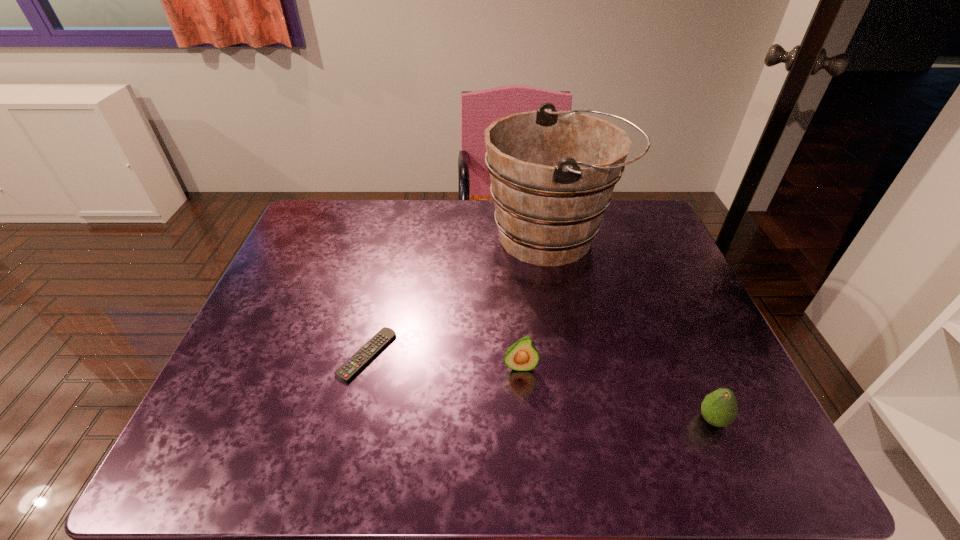
Where is `free region that satisfies the following two spatial constraints: 1. on the handle side of the right avocado; 2. on the left side of the bucket`? The width and height of the screenshot is (960, 540). free region that satisfies the following two spatial constraints: 1. on the handle side of the right avocado; 2. on the left side of the bucket is located at coordinates (589, 420).

You are a GUI agent. You are given a task and a screenshot of the screen. Output one action in this format:
    pyautogui.click(x=<x>, y=<y>)
    Task: Click on the free space that satisfies the following two spatial constraints: 1. on the front side of the rightmost object; 2. on the left side of the leftmost object
    
    Given the screenshot: What is the action you would take?
    pyautogui.click(x=351, y=420)